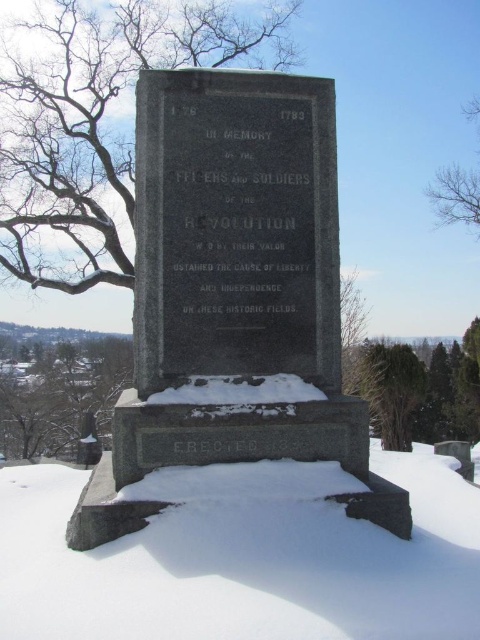
You are an artist sketching the monument and notice the green leafy tree at lower right and the bare branches at upper right. Which object has a smaller width?

The green leafy tree at lower right is thinner than the bare branches at upper right, so the green leafy tree at lower right has a smaller width.

You are standing in front of the monument and see the bare branches at left and the bare branches at upper right. Which one is located to the left of the other?

The bare branches at left is positioned on the left side of bare branches at upper right.

You are standing in front of the monument and want to take a photo that includes both the green leafy tree at lower right and the bare branches at upper right. Which object should appear closer to the camera in the photo?

The green leafy tree at lower right should appear closer to the camera because it is further to the viewer than the bare branches at upper right, meaning it is positioned nearer in the scene.